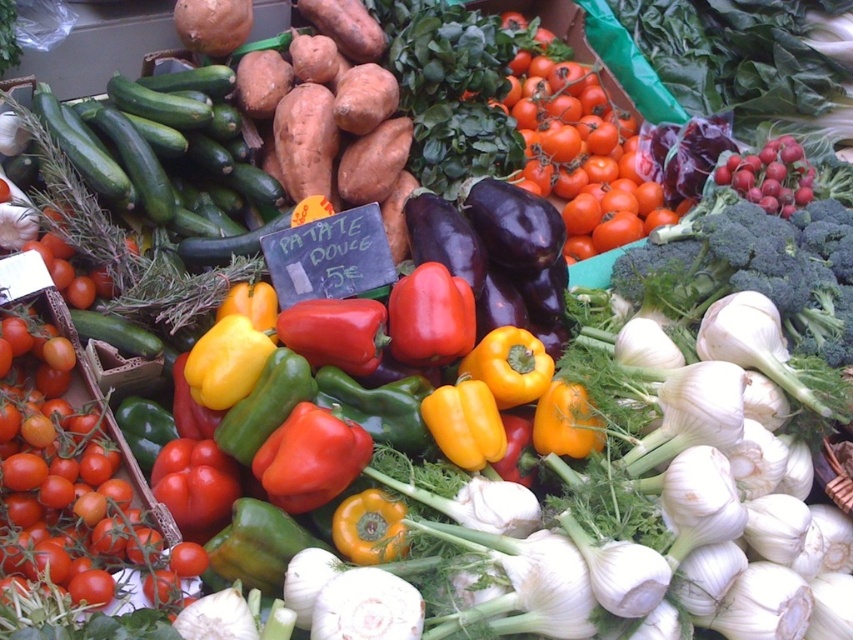
Question: Which point appears farthest from the camera in this image?

Choices:
 (A) (608, 168)
 (B) (36, 476)

Answer: (A)

Question: Which of the following is the closest to the observer?

Choices:
 (A) (537, 122)
 (B) (149, 566)

Answer: (B)

Question: Observing the image, what is the correct spatial positioning of smooth red tomato at center in reference to shiny red tomatoes at center?

Choices:
 (A) right
 (B) left

Answer: (B)

Question: Is smooth red tomato at center to the left of shiny red tomatoes at center from the viewer's perspective?

Choices:
 (A) yes
 (B) no

Answer: (A)

Question: Can you confirm if smooth red tomato at center is bigger than shiny red tomatoes at center?

Choices:
 (A) yes
 (B) no

Answer: (B)